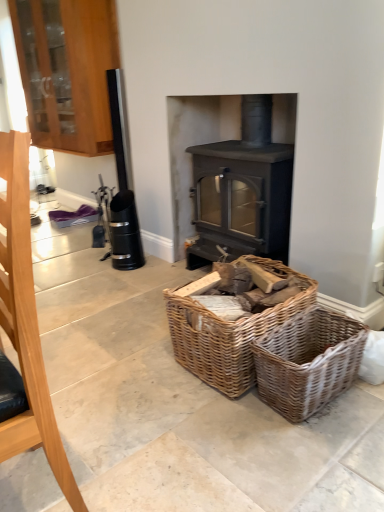
At what (x,y) coordinates should I click in order to perform the action: click on free region under brushed metal fireplace tool at left (from a real-world perspective). Please return your answer as a coordinate pair (x, y). The image size is (384, 512). Looking at the image, I should click on (33, 485).